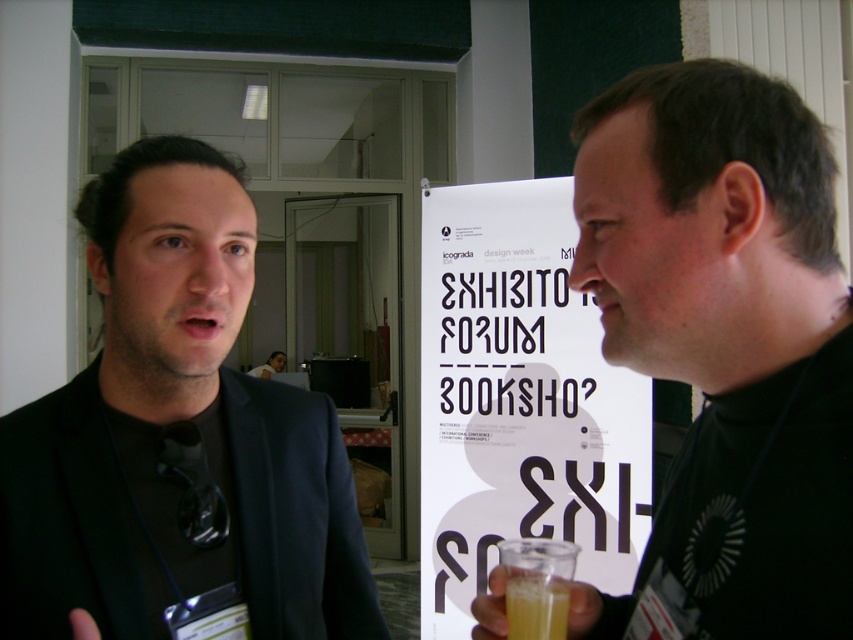
Does matte black suit at left have a larger size compared to white paper poster at center?

No.

Between matte black suit at left and white paper poster at center, which one appears on the left side from the viewer's perspective?

matte black suit at left is more to the left.

Where is `matte black suit at left`? The height and width of the screenshot is (640, 853). matte black suit at left is located at coordinates coord(177,436).

The width and height of the screenshot is (853, 640). I want to click on matte black suit at left, so click(x=177, y=436).

Does black turtleneck sweater at right come behind matte black suit at left?

That is False.

Does black turtleneck sweater at right have a larger size compared to matte black suit at left?

Actually, black turtleneck sweater at right might be smaller than matte black suit at left.

Does point (695, 180) come in front of point (287, 468)?

Yes, it is.

Find the location of `black turtleneck sweater at right`. black turtleneck sweater at right is located at coordinates (724, 344).

Does point (467, 236) come farther from viewer compared to point (277, 355)?

No, it is in front of (277, 355).

Can you confirm if white paper poster at center is positioned to the left of light blue shirt at center?

In fact, white paper poster at center is to the right of light blue shirt at center.

Does point (490, 284) come closer to viewer compared to point (271, 371)?

Yes, it is.

Locate an element on the screen. Image resolution: width=853 pixels, height=640 pixels. white paper poster at center is located at coordinates (519, 401).